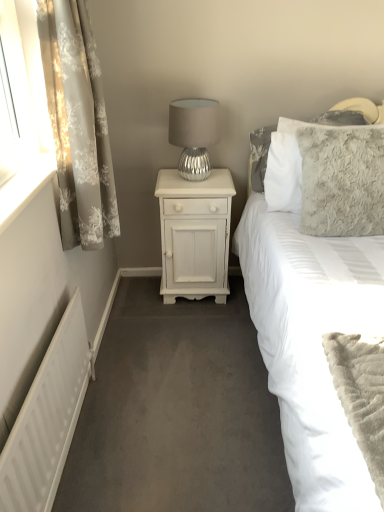
Find the location of a particular element. The width and height of the screenshot is (384, 512). free point to the left of white painted wood nightstand at center is located at coordinates (137, 305).